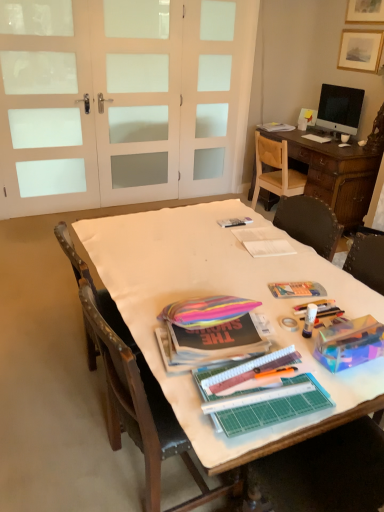
What are the coordinates of `free point behind rainbow fabric bag at center, which ranks as the 3th magazine in right-to-left order` in the screenshot? It's located at (209, 282).